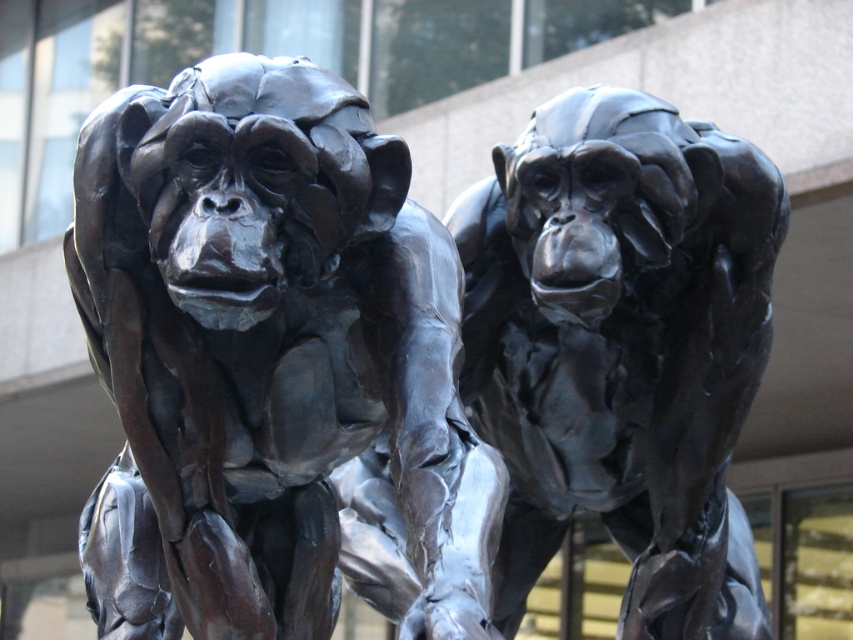
Question: Observing the image, what is the correct spatial positioning of bronze statue at center in reference to polished bronze monkey at center?

Choices:
 (A) right
 (B) left

Answer: (B)

Question: Which point is farther to the camera?

Choices:
 (A) (505, 208)
 (B) (207, 96)

Answer: (A)

Question: Does bronze statue at center have a lesser width compared to polished bronze monkey at center?

Choices:
 (A) no
 (B) yes

Answer: (A)

Question: Considering the relative positions of bronze statue at center and polished bronze monkey at center in the image provided, where is bronze statue at center located with respect to polished bronze monkey at center?

Choices:
 (A) right
 (B) left

Answer: (B)

Question: Which point is closer to the camera taking this photo?

Choices:
 (A) (553, 314)
 (B) (148, 541)

Answer: (B)